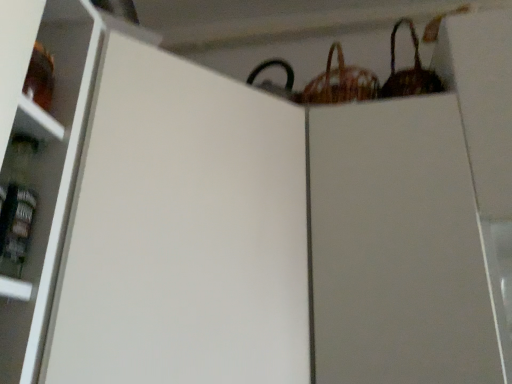
Question: In the image, is white matte cabinet at center on the left side or the right side of woven brown basket at upper right, the first basket from the left?

Choices:
 (A) right
 (B) left

Answer: (B)

Question: From the image's perspective, is white matte cabinet at center located above or below woven brown basket at upper right, the first basket from the left?

Choices:
 (A) below
 (B) above

Answer: (A)

Question: Which is farther from the woven brown basket at upper right, the 2th basket viewed from the right?

Choices:
 (A) woven brown basket at upper right, the 2th basket from the left
 (B) white matte cabinet at center

Answer: (B)

Question: Which object is positioned closest to the woven brown basket at upper right, the first basket from the left?

Choices:
 (A) woven brown basket at upper right, the 2th basket from the left
 (B) white matte cabinet at center

Answer: (A)